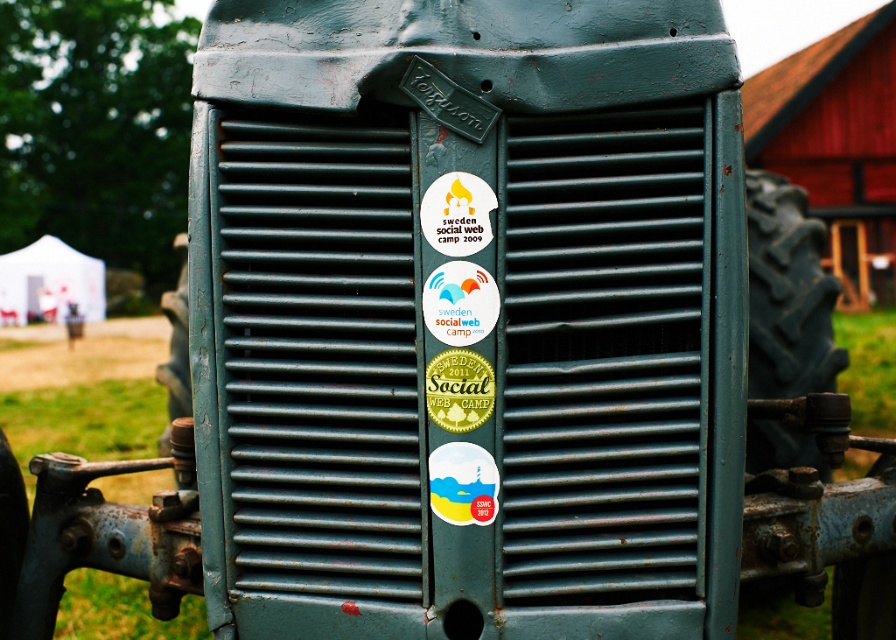
What are the coordinates of the white paper sticker at center?

The white paper sticker at center is located at point (457, 212).

You are designing a poster for an event and want to replicate the sticker arrangement on the tractor grille. Which sticker should you make larger to match the original? The options are the white paper sticker at center and the green matte sticker at center.

The white paper sticker at center should be made larger than the green matte sticker at center to match the original arrangement on the tractor grille.